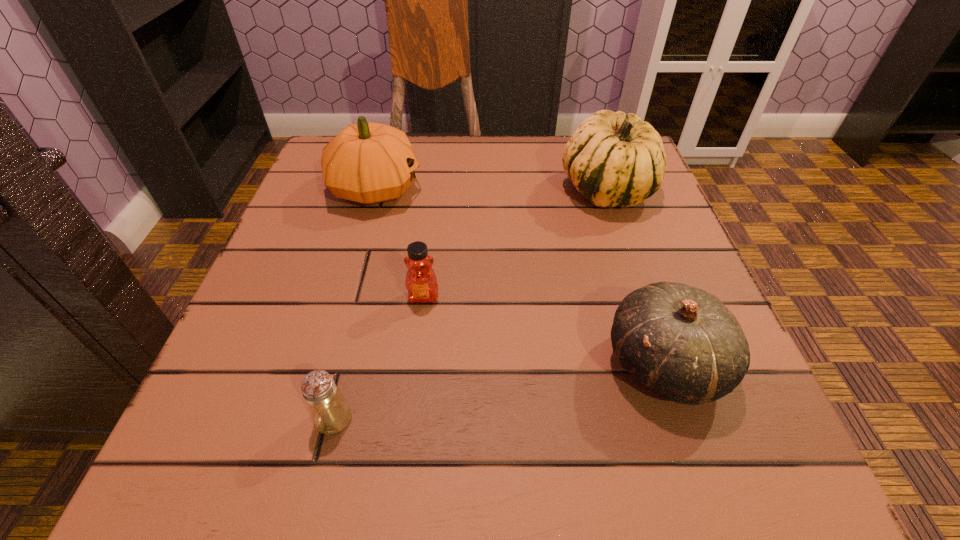
Find the location of `free space that satisfies the following two spatial constraints: 1. on the front label of the third object from right to left; 2. on the left side of the shortest gourd`. free space that satisfies the following two spatial constraints: 1. on the front label of the third object from right to left; 2. on the left side of the shortest gourd is located at coordinates (416, 364).